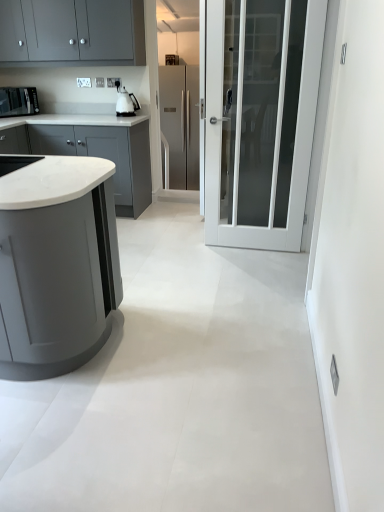
Question: Is matte gray cabinets at upper left, positioned as the second cabinetry in front-to-back order, not inside stainless steel refrigerator at center?

Choices:
 (A) no
 (B) yes

Answer: (B)

Question: Considering the relative sizes of matte gray cabinets at upper left, placed as the first cabinetry when sorted from top to bottom, and stainless steel refrigerator at center in the image provided, is matte gray cabinets at upper left, placed as the first cabinetry when sorted from top to bottom, wider than stainless steel refrigerator at center?

Choices:
 (A) yes
 (B) no

Answer: (B)

Question: Is matte gray cabinets at upper left, the third cabinetry positioned from the bottom, at the left side of stainless steel refrigerator at center?

Choices:
 (A) no
 (B) yes

Answer: (B)

Question: Can you confirm if matte gray cabinets at upper left, positioned as the second cabinetry in front-to-back order, is thinner than stainless steel refrigerator at center?

Choices:
 (A) yes
 (B) no

Answer: (A)

Question: Does matte gray cabinets at upper left, positioned as the second cabinetry in front-to-back order, turn towards stainless steel refrigerator at center?

Choices:
 (A) yes
 (B) no

Answer: (B)

Question: Considering their positions, is matte gray cabinet at left, which appears as the 1th cabinetry when ordered from the bottom, located in front of or behind stainless steel refrigerator at center?

Choices:
 (A) front
 (B) behind

Answer: (A)

Question: From a real-world perspective, relative to stainless steel refrigerator at center, is matte gray cabinet at left, which appears as the 1th cabinetry when viewed from the front, vertically above or below?

Choices:
 (A) above
 (B) below

Answer: (A)

Question: Is matte gray cabinet at left, which appears as the 1th cabinetry when ordered from the bottom, bigger or smaller than stainless steel refrigerator at center?

Choices:
 (A) small
 (B) big

Answer: (A)

Question: From the image's perspective, is matte gray cabinet at left, the 3th cabinetry viewed from the back, above or below stainless steel refrigerator at center?

Choices:
 (A) above
 (B) below

Answer: (B)

Question: Considering the positions of stainless steel refrigerator at center and matte gray cabinets at upper left, the third cabinetry positioned from the bottom, in the image, is stainless steel refrigerator at center bigger or smaller than matte gray cabinets at upper left, the third cabinetry positioned from the bottom,?

Choices:
 (A) small
 (B) big

Answer: (B)

Question: Is stainless steel refrigerator at center spatially inside matte gray cabinets at upper left, the third cabinetry positioned from the bottom, or outside of it?

Choices:
 (A) inside
 (B) outside

Answer: (B)

Question: Is stainless steel refrigerator at center wider or thinner than matte gray cabinets at upper left, which appears as the 2th cabinetry when viewed from the back?

Choices:
 (A) thin
 (B) wide

Answer: (B)

Question: Based on their positions, is stainless steel refrigerator at center located to the left or right of matte gray cabinets at upper left, placed as the first cabinetry when sorted from top to bottom?

Choices:
 (A) left
 (B) right

Answer: (B)

Question: Is matte gray cabinets at upper left, positioned as the second cabinetry in front-to-back order, taller or shorter than matte black microwave at upper left, placed as the 1th kitchen appliance when sorted from left to right?

Choices:
 (A) short
 (B) tall

Answer: (B)

Question: From a real-world perspective, is matte gray cabinets at upper left, placed as the first cabinetry when sorted from top to bottom, positioned above or below matte black microwave at upper left, placed as the second kitchen appliance when sorted from right to left?

Choices:
 (A) above
 (B) below

Answer: (A)